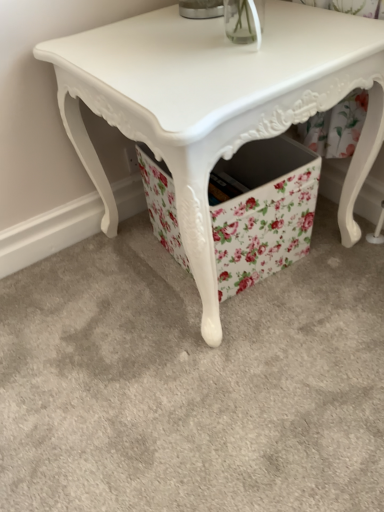
Question: In the image, is white glossy table at center positioned in front of or behind floral fabric storage box at lower center?

Choices:
 (A) front
 (B) behind

Answer: (A)

Question: Would you say white glossy table at center is inside or outside floral fabric storage box at lower center?

Choices:
 (A) inside
 (B) outside

Answer: (B)

Question: Looking at their shapes, would you say white glossy table at center is wider or thinner than floral fabric storage box at lower center?

Choices:
 (A) wide
 (B) thin

Answer: (A)

Question: Looking at their shapes, would you say floral fabric storage box at lower center is wider or thinner than white glossy table at center?

Choices:
 (A) wide
 (B) thin

Answer: (B)

Question: Considering the positions of floral fabric storage box at lower center and white glossy table at center in the image, is floral fabric storage box at lower center bigger or smaller than white glossy table at center?

Choices:
 (A) big
 (B) small

Answer: (B)

Question: Is floral fabric storage box at lower center inside the boundaries of white glossy table at center, or outside?

Choices:
 (A) inside
 (B) outside

Answer: (A)

Question: In the image, is floral fabric storage box at lower center on the left side or the right side of white glossy table at center?

Choices:
 (A) right
 (B) left

Answer: (A)